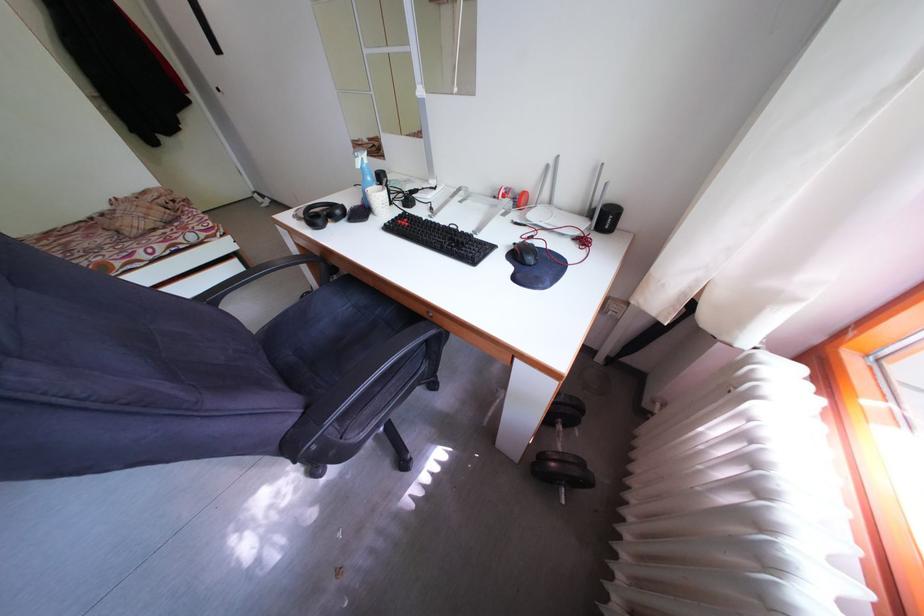
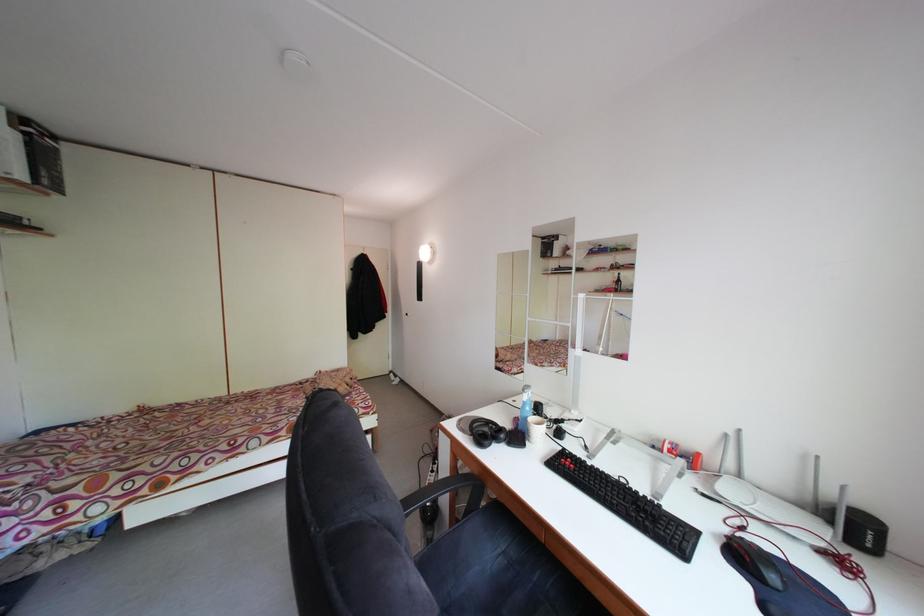
Locate, in the second image, the point that corresponds to point (321, 223) in the first image.

(488, 440)